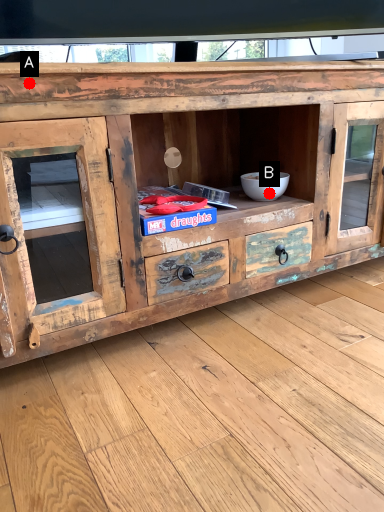
Question: Two points are circled on the image, labeled by A and B beside each circle. Which point is further to the camera?

Choices:
 (A) A is further
 (B) B is further

Answer: (B)